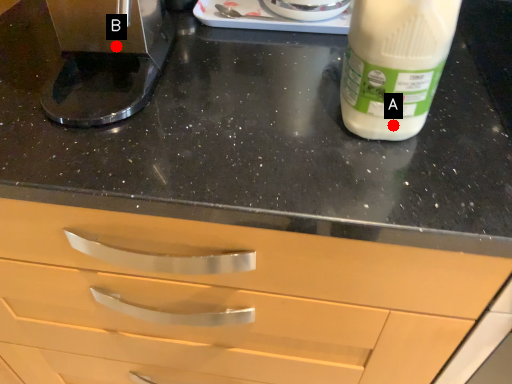
Question: Two points are circled on the image, labeled by A and B beside each circle. Which point is farther from the camera taking this photo?

Choices:
 (A) A is further
 (B) B is further

Answer: (B)